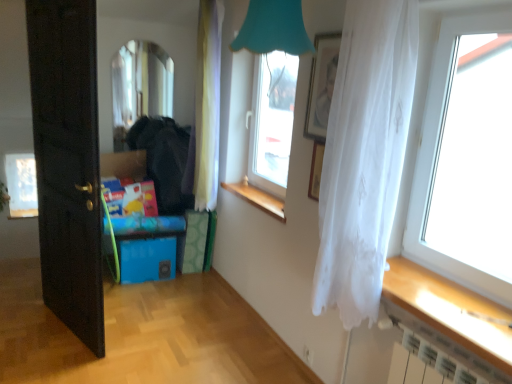
The width and height of the screenshot is (512, 384). In order to click on free point below transparent glass window at right, which ranks as the first window in right-to-left order (from a real-world perspective) in this screenshot , I will do `click(450, 283)`.